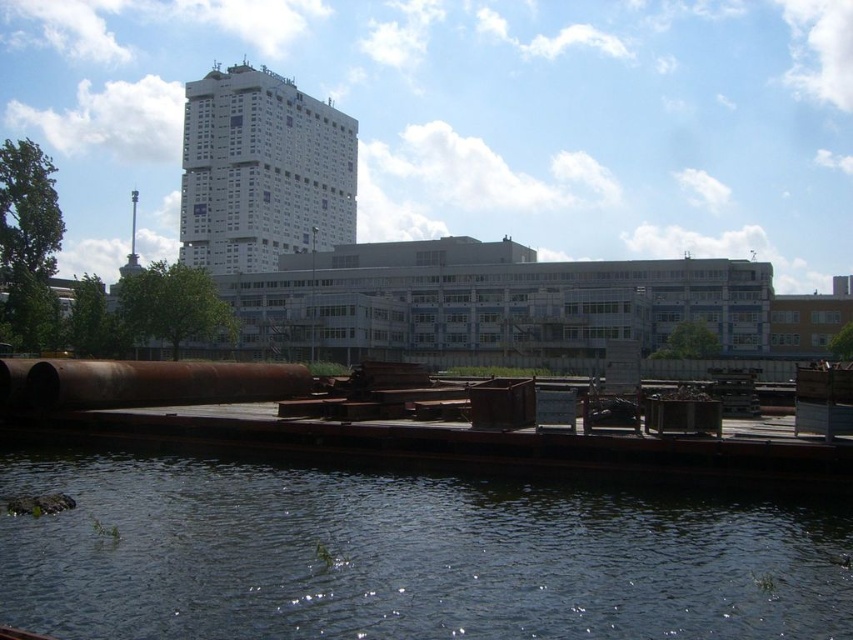
You are standing at the waterfront and want to throw a small stone into the dark blue water at lower center. However, there is a rusty metal pipe at lower center in the way. Can you throw the stone over the pipe to reach the water?

The dark blue water at lower center is closer to the viewer than the rusty metal pipe at lower center, so you can throw the stone over the pipe to reach the water.

You are a delivery person who needs to cross from the rusty metal pipe at lower center to the wooden platform on the left. Can you step onto the dark blue water at lower center to reach the platform?

The dark blue water at lower center is shorter than the rusty metal pipe at lower center, so stepping onto it would not be possible as it is lower than the pipe. You should find another path.

You are standing at the point labeled point (132, 557) and want to walk towards the point labeled point (57, 388). Given that you can only move in a straight line, will you need to walk forward or backward to reach your destination?

You will need to walk backward to reach the point labeled point (57, 388) because it is farther away from the camera compared to your current position at point (132, 557).